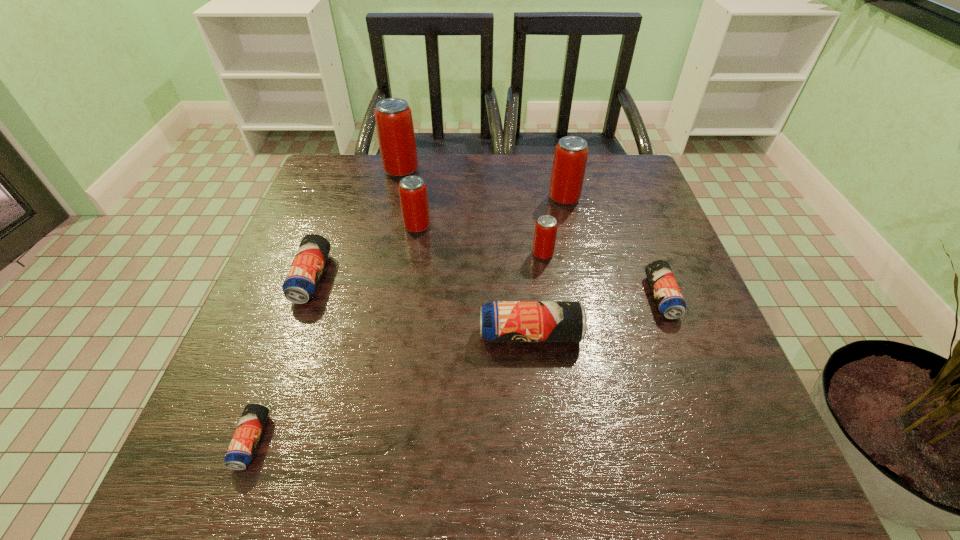
In the image, there is a desktop. In order to click on free space at the right edge in this screenshot , I will do `click(639, 228)`.

In the image, there is a desktop. Where is `vacant area at the far left corner`? vacant area at the far left corner is located at coordinates (339, 176).

Where is `free spot at the near left corner of the desktop`? The width and height of the screenshot is (960, 540). free spot at the near left corner of the desktop is located at coordinates coord(250,491).

This screenshot has height=540, width=960. I want to click on vacant space at the far right corner, so click(x=615, y=171).

Where is `free space at the near right corner`? The width and height of the screenshot is (960, 540). free space at the near right corner is located at coordinates (684, 472).

Image resolution: width=960 pixels, height=540 pixels. In order to click on free space between the sixth tallest object and the second shortest object in this screenshot , I will do `click(487, 287)`.

I want to click on free area in between the third farthest pink beer can and the second tallest object, so click(491, 212).

Locate an element on the screen. Image resolution: width=960 pixels, height=540 pixels. vacant area between the shortest object and the second smallest blue beer can is located at coordinates (457, 369).

I want to click on free spot between the smallest blue beer can and the second blue beer can from right to left, so click(x=391, y=387).

Find the location of `free space that is in between the third smallest blue beer can and the fourth tallest object`. free space that is in between the third smallest blue beer can and the fourth tallest object is located at coordinates (427, 266).